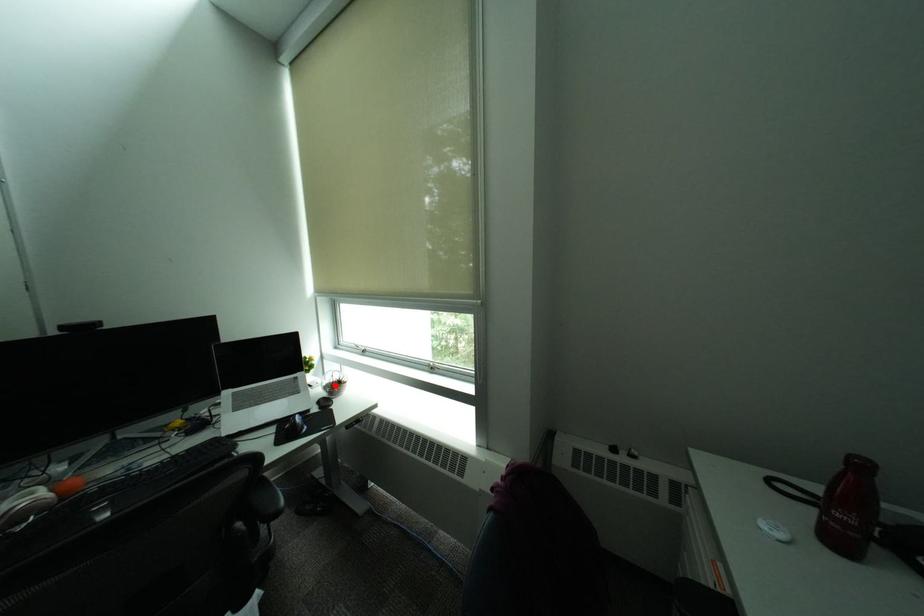
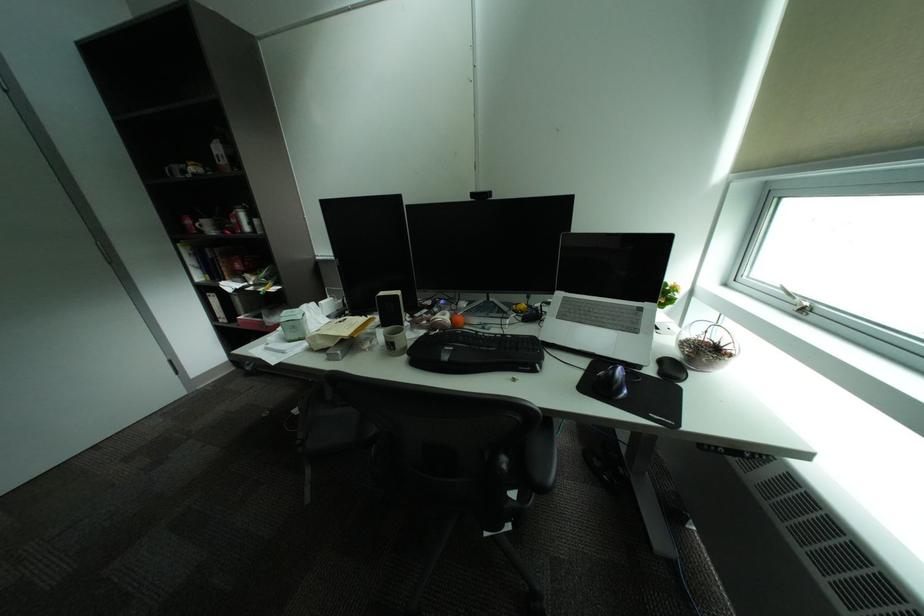
Question: I am providing you with two images of the same scene from different viewpoints. A red point is shown in image1. For the corresponding object point in image2, is it positioned nearer or farther from the camera?

Choices:
 (A) Nearer
 (B) Farther

Answer: (A)